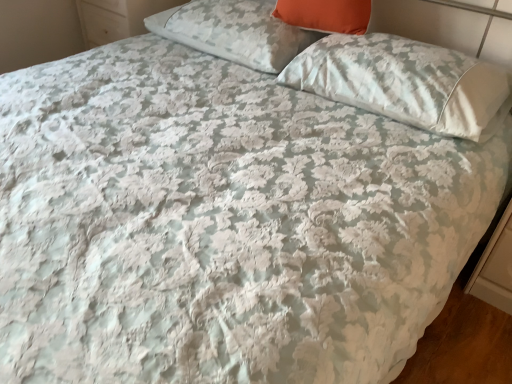
Question: From the image's perspective, is white glossy dresser at upper left on orange fabric pillow at upper center, acting as the 2th pillow starting from the right?

Choices:
 (A) yes
 (B) no

Answer: (A)

Question: From the image's perspective, does white glossy dresser at upper left appear lower than orange fabric pillow at upper center, acting as the 2th pillow starting from the left?

Choices:
 (A) yes
 (B) no

Answer: (B)

Question: Is white glossy dresser at upper left to the right of orange fabric pillow at upper center, acting as the 2th pillow starting from the right, from the viewer's perspective?

Choices:
 (A) no
 (B) yes

Answer: (A)

Question: Is white glossy dresser at upper left outside orange fabric pillow at upper center, acting as the 2th pillow starting from the left?

Choices:
 (A) yes
 (B) no

Answer: (A)

Question: Considering the relative positions of white glossy dresser at upper left and orange fabric pillow at upper center, acting as the 2th pillow starting from the left, in the image provided, is white glossy dresser at upper left to the left of orange fabric pillow at upper center, acting as the 2th pillow starting from the left, from the viewer's perspective?

Choices:
 (A) no
 (B) yes

Answer: (B)

Question: From a real-world perspective, is white glossy dresser at upper left beneath orange fabric pillow at upper center, acting as the 2th pillow starting from the right?

Choices:
 (A) no
 (B) yes

Answer: (B)

Question: Is white glossy dresser at upper left not near white satin pillow at upper right, placed as the 3th pillow when sorted from left to right?

Choices:
 (A) yes
 (B) no

Answer: (A)

Question: Is white glossy dresser at upper left positioned with its back to white satin pillow at upper right, marked as the 1th pillow in a right-to-left arrangement?

Choices:
 (A) yes
 (B) no

Answer: (B)

Question: Would you say white glossy dresser at upper left is outside white satin pillow at upper right, placed as the 3th pillow when sorted from left to right?

Choices:
 (A) yes
 (B) no

Answer: (A)

Question: Is white glossy dresser at upper left positioned before white satin pillow at upper right, marked as the 1th pillow in a right-to-left arrangement?

Choices:
 (A) no
 (B) yes

Answer: (A)

Question: Does white glossy dresser at upper left have a larger size compared to white satin pillow at upper right, placed as the 3th pillow when sorted from left to right?

Choices:
 (A) no
 (B) yes

Answer: (B)

Question: Is white glossy dresser at upper left facing towards white satin pillow at upper right, placed as the 3th pillow when sorted from left to right?

Choices:
 (A) yes
 (B) no

Answer: (B)

Question: Is white floral fabric pillow at upper center, the first pillow when ordered from left to right, behind white satin pillow at upper right, placed as the 3th pillow when sorted from left to right?

Choices:
 (A) yes
 (B) no

Answer: (A)